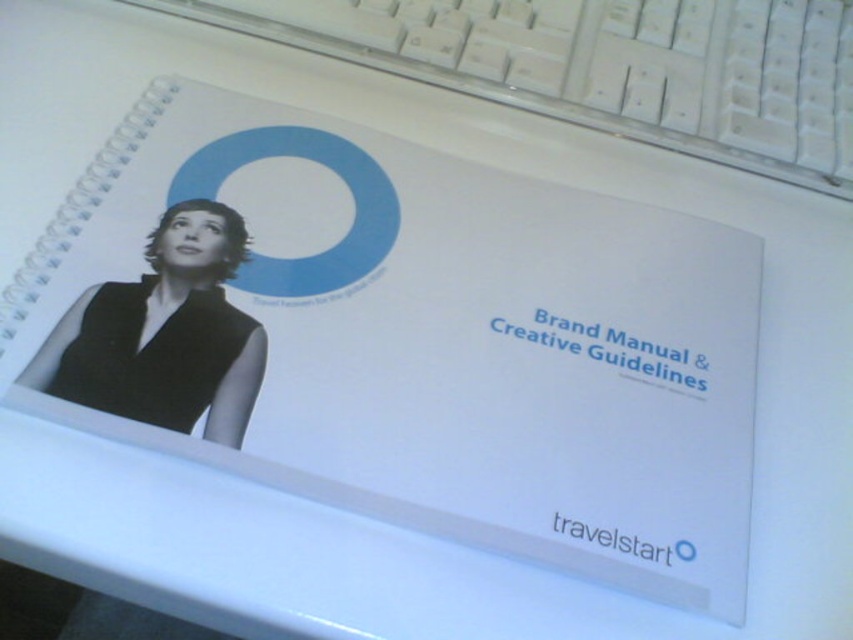
You are an office worker who needs to locate a specific point on the desk. The point is at coordinates point (608,65). According to the image, where exactly is this point located?

The point (608,65) is located on the white plastic keyboard at upper center.